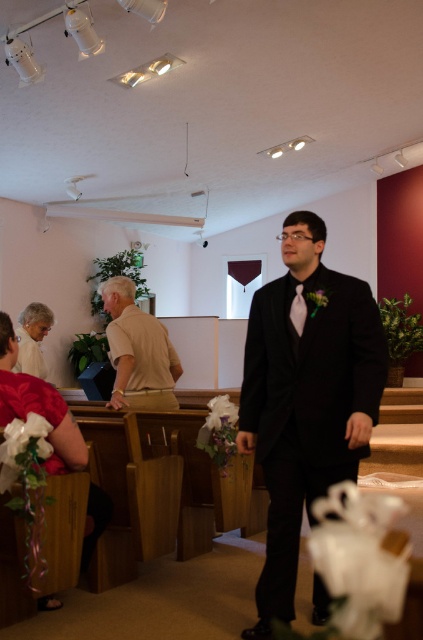
You are standing at the point marked as point [19,330] in the image. You want to walk directly towards the front of the church where the wedding is taking place. How far will you have to walk to reach the front?

The distance between you at point [19,330] and the front of the church is 3.95 meters, so you will have to walk 3.95 meters to reach the front.

In the church scene, there is a black satin suit at center and a white satin dress at lower left. From the perspective of someone standing at the entrance facing the altar, which object is positioned to the right?

The black satin suit at center is to the right of the white satin dress at lower left.

You are a photographer at a wedding and need to capture a group photo. You have to position the black satin suit at center and the white satin dress at lower left in the frame. Considering their sizes, which one should you place closer to the camera to ensure both appear proportionally balanced in the photo?

The black satin suit at center is bigger than the white satin dress at lower left. To balance their sizes in the photo, place the white satin dress at lower left closer to the camera so it appears larger, while the black satin suit at center can be positioned farther back to reduce its apparent size.